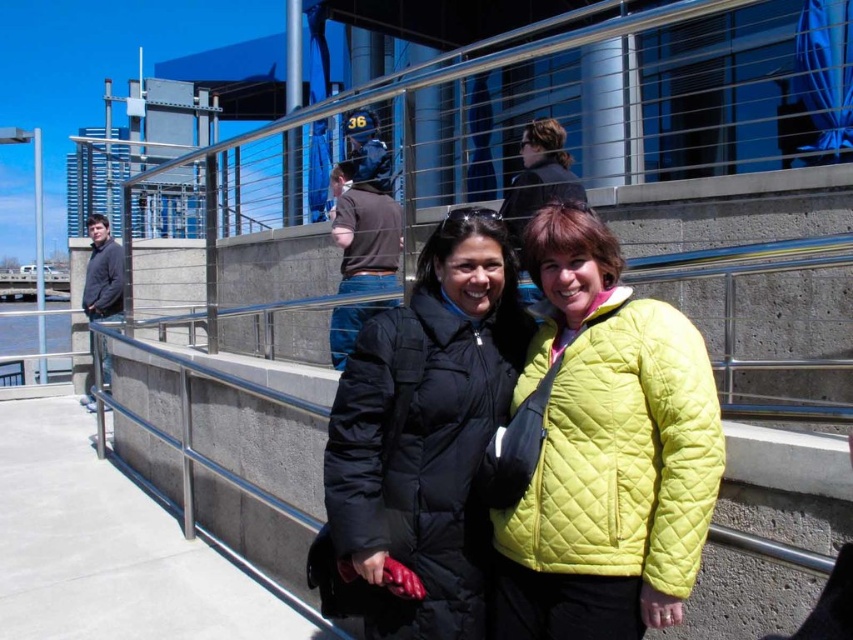
Question: In this image, where is lime quilted jacket at center located relative to dark gray quilted jacket at left?

Choices:
 (A) above
 (B) below

Answer: (B)

Question: Which of the following is the farthest from the observer?

Choices:
 (A) lime quilted jacket at center
 (B) dark gray quilted jacket at left
 (C) black quilted jacket at center

Answer: (B)

Question: Among these points, which one is nearest to the camera?

Choices:
 (A) [x=428, y=472]
 (B) [x=573, y=340]

Answer: (B)

Question: Does black quilted jacket at center appear on the left side of dark gray quilted jacket at left?

Choices:
 (A) yes
 (B) no

Answer: (B)

Question: Is black quilted jacket at center bigger than lime quilted jacket at center?

Choices:
 (A) no
 (B) yes

Answer: (B)

Question: Which object is the farthest from the lime quilted jacket at center?

Choices:
 (A) black quilted jacket at center
 (B) dark gray quilted jacket at left

Answer: (B)